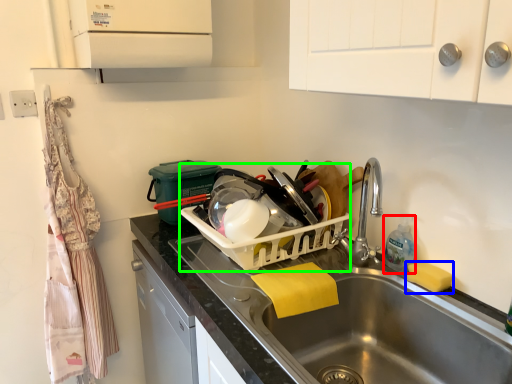
Question: Based on their relative distances, which object is nearer to bottle (highlighted by a red box)? Choose from soap (highlighted by a blue box) and appliance (highlighted by a green box).

Choices:
 (A) soap
 (B) appliance

Answer: (A)